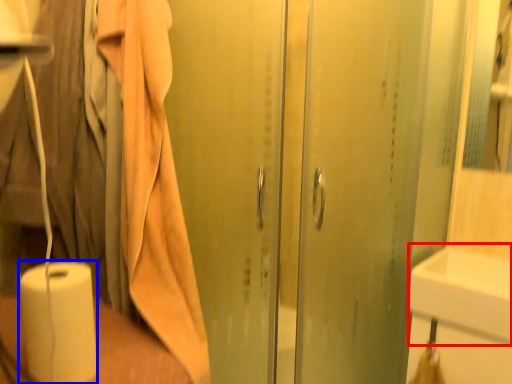
Question: Which of the following is the farthest to the observer, sink (highlighted by a red box) or paper towel (highlighted by a blue box)?

Choices:
 (A) sink
 (B) paper towel

Answer: (A)